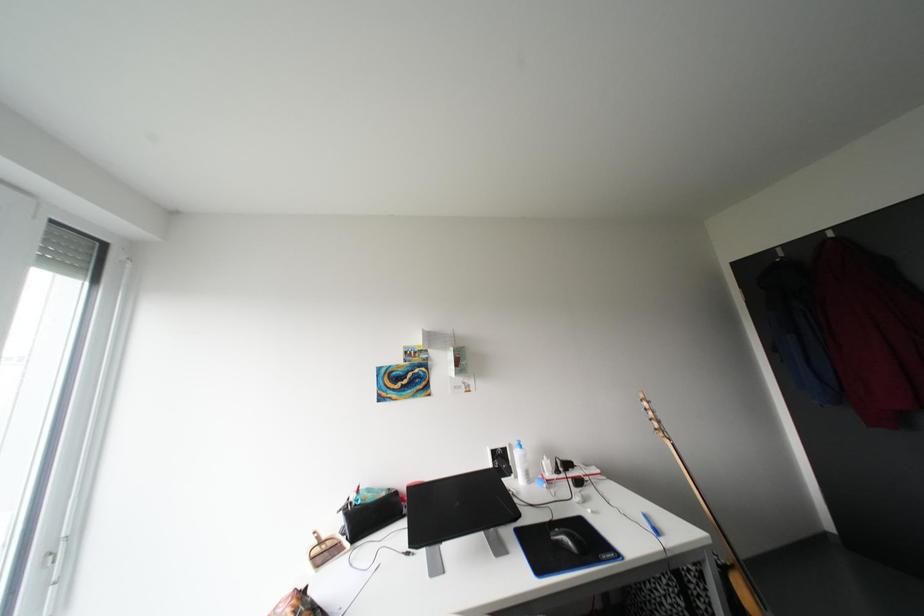
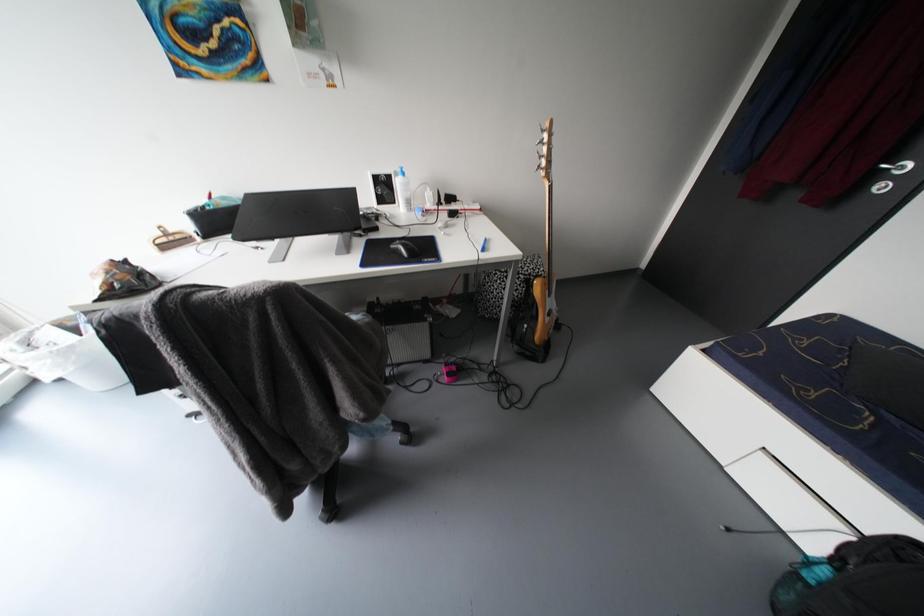
First-person continuous shooting, in which direction is the camera rotating?

The camera rotated toward right-down.